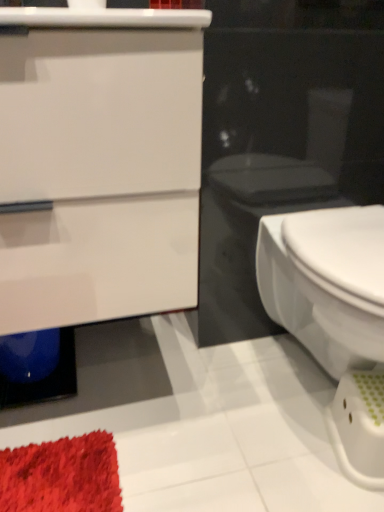
Question: From a real-world perspective, is white glossy cabinet at upper left physically located above or below white glossy bidet at right?

Choices:
 (A) above
 (B) below

Answer: (A)

Question: In terms of width, does white glossy cabinet at upper left look wider or thinner when compared to white glossy bidet at right?

Choices:
 (A) thin
 (B) wide

Answer: (A)

Question: Is white glossy cabinet at upper left spatially inside white glossy bidet at right, or outside of it?

Choices:
 (A) outside
 (B) inside

Answer: (A)

Question: Considering the relative positions of white glossy bidet at right and white glossy cabinet at upper left in the image provided, is white glossy bidet at right to the left or to the right of white glossy cabinet at upper left?

Choices:
 (A) right
 (B) left

Answer: (A)

Question: Would you say white glossy bidet at right is inside or outside white glossy cabinet at upper left?

Choices:
 (A) inside
 (B) outside

Answer: (B)

Question: From a real-world perspective, is white glossy bidet at right above or below white glossy cabinet at upper left?

Choices:
 (A) above
 (B) below

Answer: (B)

Question: From their relative heights in the image, would you say white glossy bidet at right is taller or shorter than white glossy cabinet at upper left?

Choices:
 (A) tall
 (B) short

Answer: (B)